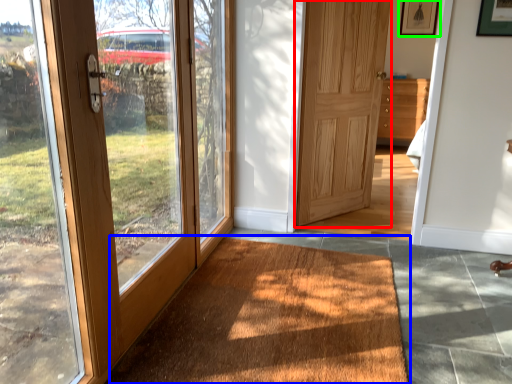
Question: Which object is positioned farthest from door (highlighted by a red box)? Select from doormat (highlighted by a blue box) and picture frame (highlighted by a green box).

Choices:
 (A) doormat
 (B) picture frame

Answer: (A)